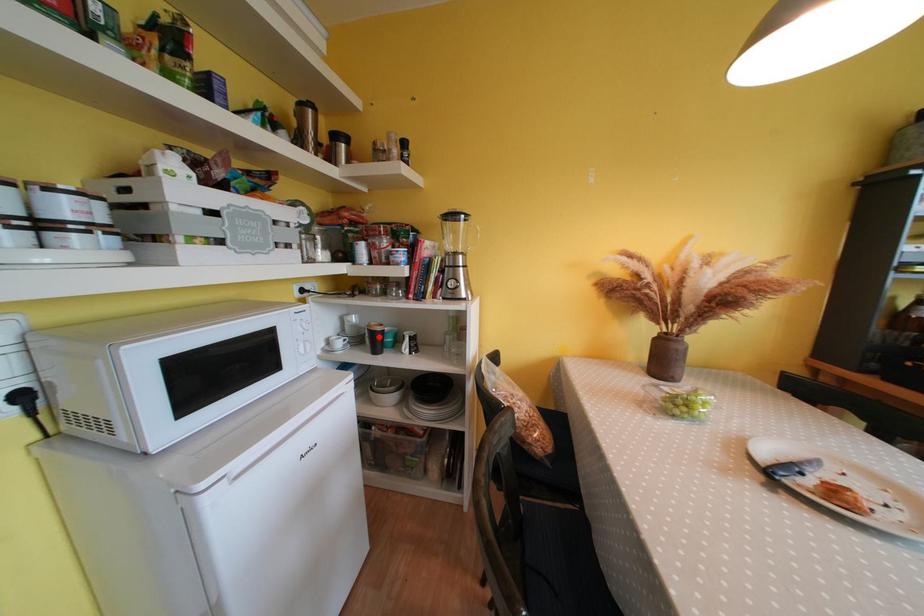
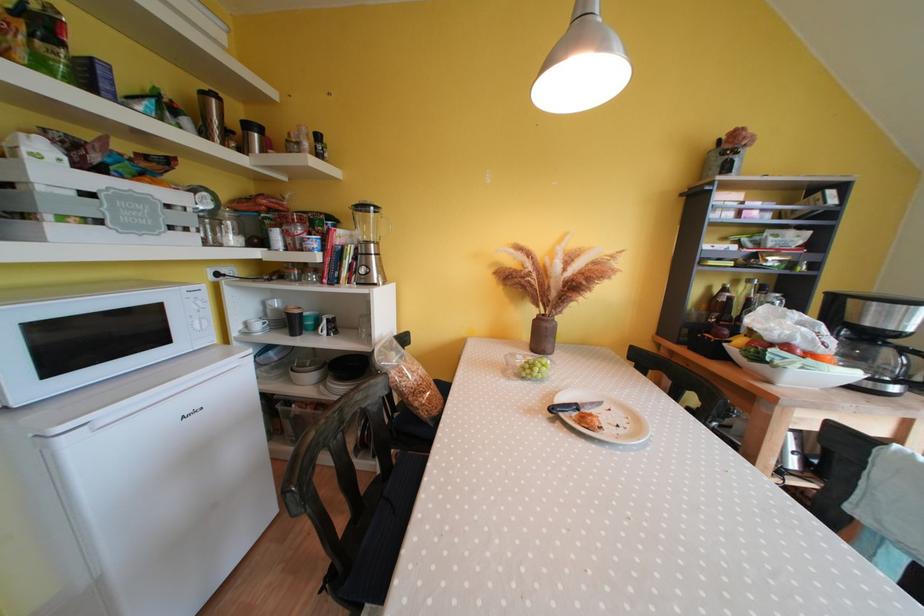
Find the pixel in the second image that matches the highlighted location in the first image.

(296, 318)